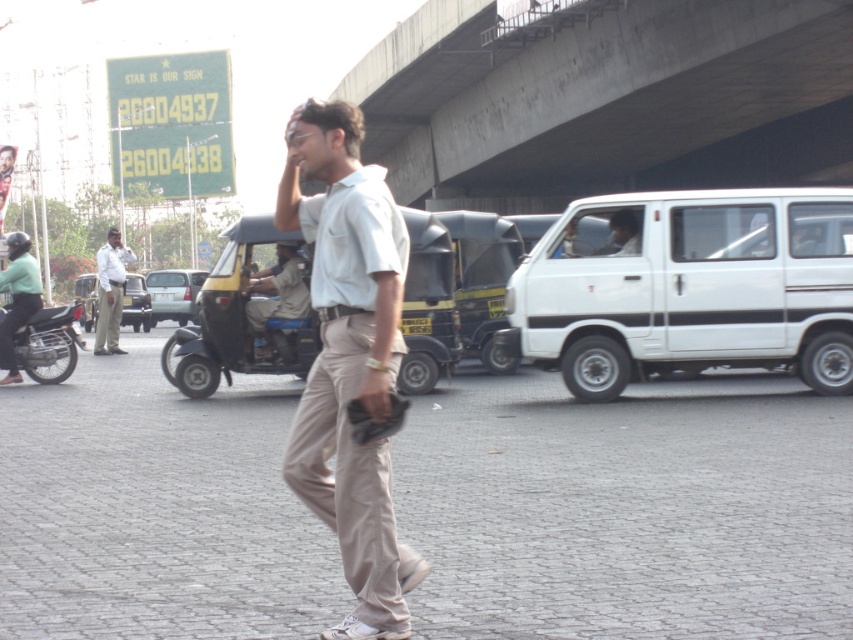
You are a delivery driver who needs to park your silver metallic sedan at center in a parking spot that is the same size as the brown stone pavement at center. Will the parking spot be large enough for your car?

The brown stone pavement at center is wider than the silver metallic sedan at center, so the parking spot will be large enough for the car.

You are standing on the sidewalk and see two points in the scene. One is at coordinates point (490, 164) and the other is at point (16, 378). Which point is closer to you?

Point (490, 164) is closer to you because it is further to the viewer than point (16, 378).